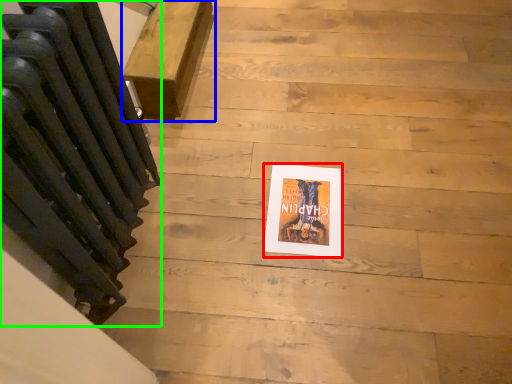
Question: Which object is positioned farthest from flyer (highlighted by a red box)? Select from furniture (highlighted by a blue box) and radiator (highlighted by a green box).

Choices:
 (A) furniture
 (B) radiator

Answer: (A)